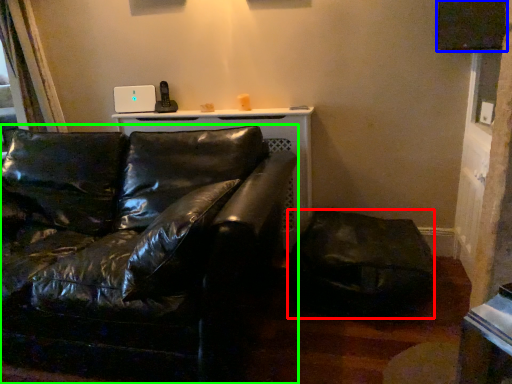
Question: Which is nearer to the swivel chair (highlighted by a red box)? window screen (highlighted by a blue box) or studio couch (highlighted by a green box).

Choices:
 (A) window screen
 (B) studio couch

Answer: (B)